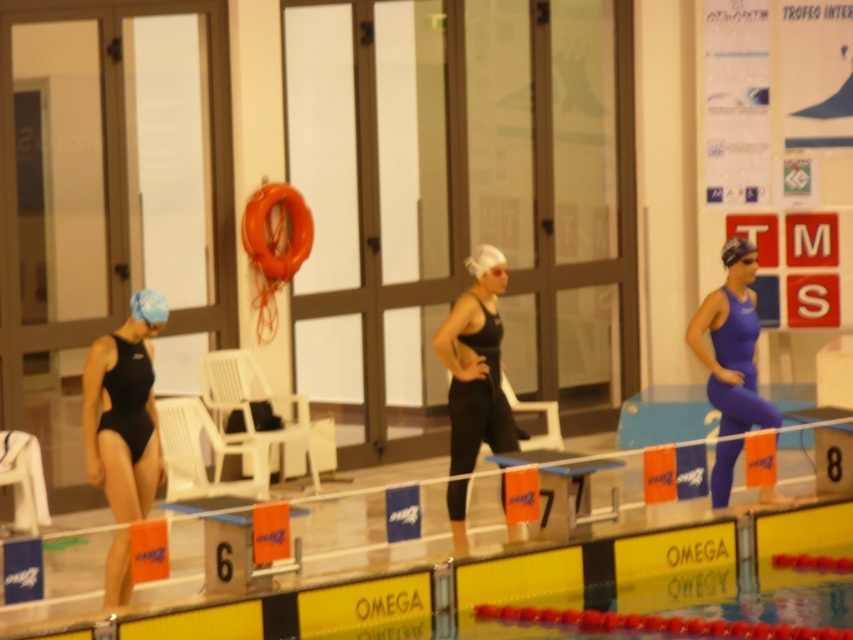
Is black matte swimsuit at left to the right of blue matte swim cap at center from the viewer's perspective?

In fact, black matte swimsuit at left is to the left of blue matte swim cap at center.

Which is in front, point (96, 440) or point (738, 248)?

Positioned in front is point (96, 440).

Is point (107, 390) farther from camera compared to point (738, 248)?

No.

Locate an element on the screen. black matte swimsuit at left is located at coordinates (125, 410).

Can you confirm if black matte swimsuit at center is taller than blue matte swimsuit at right?

Yes, black matte swimsuit at center is taller than blue matte swimsuit at right.

Does black matte swimsuit at center have a lesser height compared to blue matte swimsuit at right?

No, black matte swimsuit at center is not shorter than blue matte swimsuit at right.

Locate an element on the screen. This screenshot has height=640, width=853. black matte swimsuit at center is located at coordinates (474, 372).

The image size is (853, 640). What are the coordinates of `black matte swimsuit at center` in the screenshot? It's located at (474, 372).

Between point (718, 360) and point (738, 237), which one is positioned in front?

Positioned in front is point (738, 237).

The height and width of the screenshot is (640, 853). What are the coordinates of `blue matte swimsuit at right` in the screenshot? It's located at (732, 349).

Locate an element on the screen. blue matte swimsuit at right is located at coordinates (732, 349).

Find the location of `blue matte swimsuit at right`. blue matte swimsuit at right is located at coordinates (732, 349).